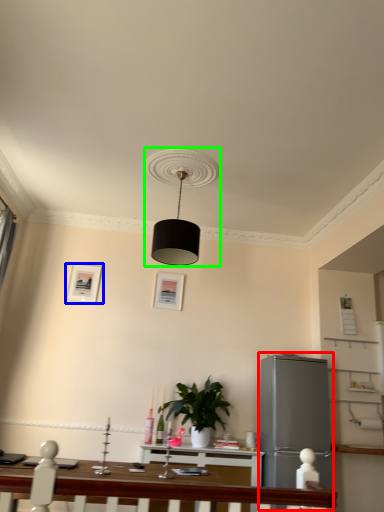
Question: Based on their relative distances, which object is farther from appliance (highlighted by a red box)? Choose from picture frame (highlighted by a blue box) and lamp (highlighted by a green box).

Choices:
 (A) picture frame
 (B) lamp

Answer: (A)